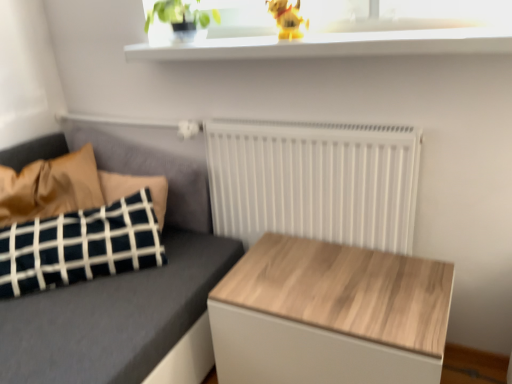
Question: Looking at the image, does green matte plant at upper center seem bigger or smaller compared to wooden table at center?

Choices:
 (A) big
 (B) small

Answer: (B)

Question: From a real-world perspective, relative to wooden table at center, is green matte plant at upper center vertically above or below?

Choices:
 (A) below
 (B) above

Answer: (B)

Question: Which object is positioned farthest from the white glossy window sill at upper center?

Choices:
 (A) wooden table at center
 (B) black-and-white checkered pillow at left
 (C) green matte plant at upper center
 (D) dark gray fabric couch at left
 (E) white matte radiator at center

Answer: (B)

Question: Estimate the real-world distances between objects in this image. Which object is closer to the white glossy window sill at upper center?

Choices:
 (A) black-and-white checkered pillow at left
 (B) green matte plant at upper center
 (C) yellow plastic dog at upper center
 (D) wooden table at center
 (E) white matte radiator at center

Answer: (C)